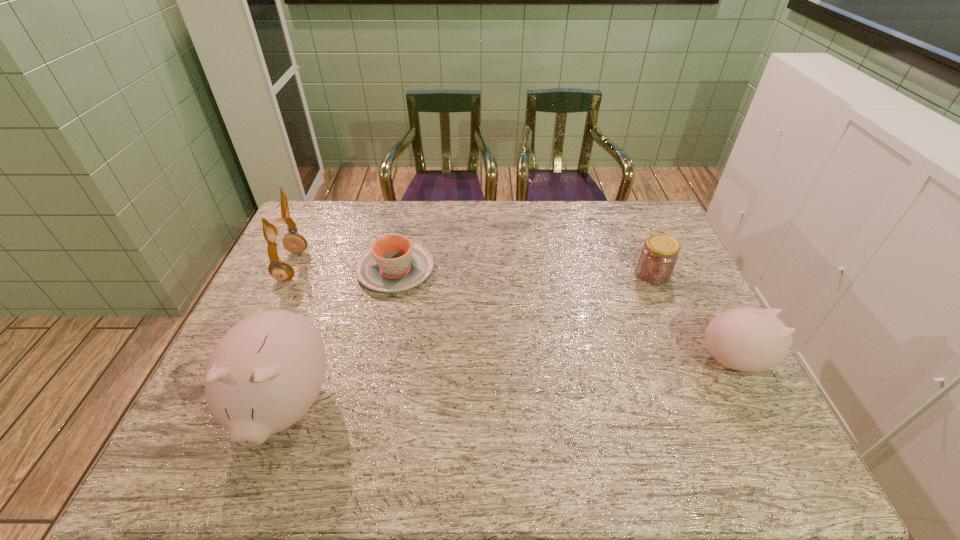
In order to click on the taller piggy bank in this screenshot , I will do `click(265, 373)`.

Identify the location of the right piggy bank. The image size is (960, 540). (747, 339).

Locate an element on the screen. the shorter piggy bank is located at coordinates (747, 339).

Image resolution: width=960 pixels, height=540 pixels. What are the coordinates of `chinaware` in the screenshot? It's located at (393, 264).

You are a GUI agent. You are given a task and a screenshot of the screen. Output one action in this format:
    pyautogui.click(x=<x>, y=<y>)
    Task: Click on the earphone
    
    Given the screenshot: What is the action you would take?
    pyautogui.click(x=281, y=270)

At what (x,y) coordinates should I click in order to perform the action: click on the fourth tallest object. Please return your answer as a coordinate pair (x, y). The width and height of the screenshot is (960, 540). Looking at the image, I should click on (659, 255).

Identify the location of free location located 0.080m on the handle side of the shortest object. This screenshot has height=540, width=960. (403, 231).

Where is `vacant position located on the handle side of the shortest object`? The width and height of the screenshot is (960, 540). vacant position located on the handle side of the shortest object is located at coordinates (404, 227).

Locate an element on the screen. The width and height of the screenshot is (960, 540). vacant space situated on the handle side of the shortest object is located at coordinates (405, 224).

Identify the location of vacant position located 0.380m on the front-facing side of the earphone. (424, 266).